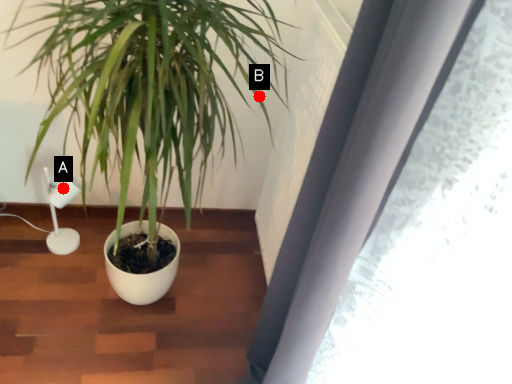
Question: Two points are circled on the image, labeled by A and B beside each circle. Which point is farther from the camera taking this photo?

Choices:
 (A) A is further
 (B) B is further

Answer: (A)